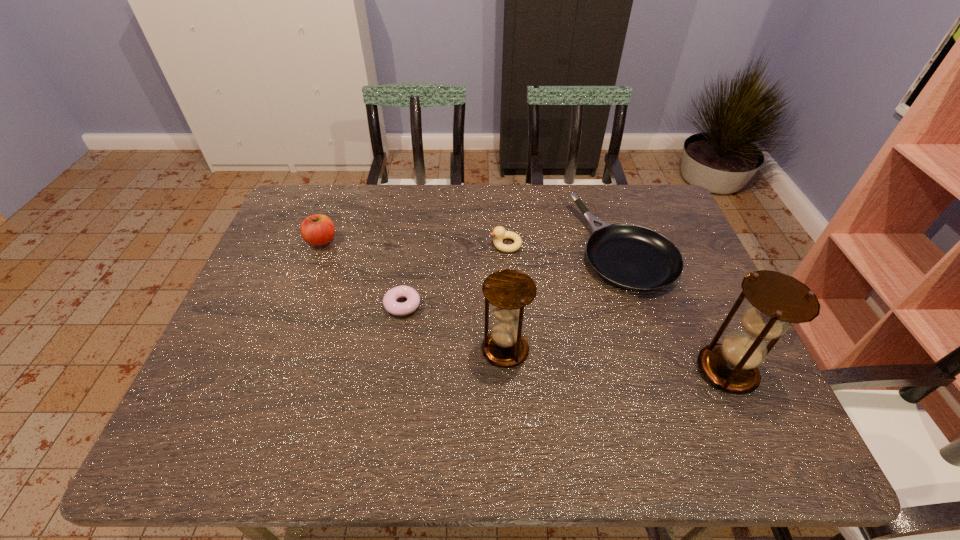
Identify which object is the fifth closest to the fifth shortest object. Please provide its 2D coordinates. Your answer should be formatted as a tuple, i.e. [(x, y)], where the tuple contains the x and y coordinates of a point satisfying the conditions above.

[(317, 230)]

Where is `object that can be found as the closest to the apple`? object that can be found as the closest to the apple is located at coordinates (390, 303).

This screenshot has width=960, height=540. Identify the location of free location that satisfies the following two spatial constraints: 1. on the front side of the leftmost object; 2. on the left side of the taller hourglass. (273, 370).

This screenshot has width=960, height=540. Find the location of `free space that satisfies the following two spatial constraints: 1. at the beak of the tallest object; 2. on the right side of the duckling`. free space that satisfies the following two spatial constraints: 1. at the beak of the tallest object; 2. on the right side of the duckling is located at coordinates (514, 370).

Image resolution: width=960 pixels, height=540 pixels. I want to click on free space that satisfies the following two spatial constraints: 1. at the beak of the pan; 2. on the left side of the duckling, so click(506, 247).